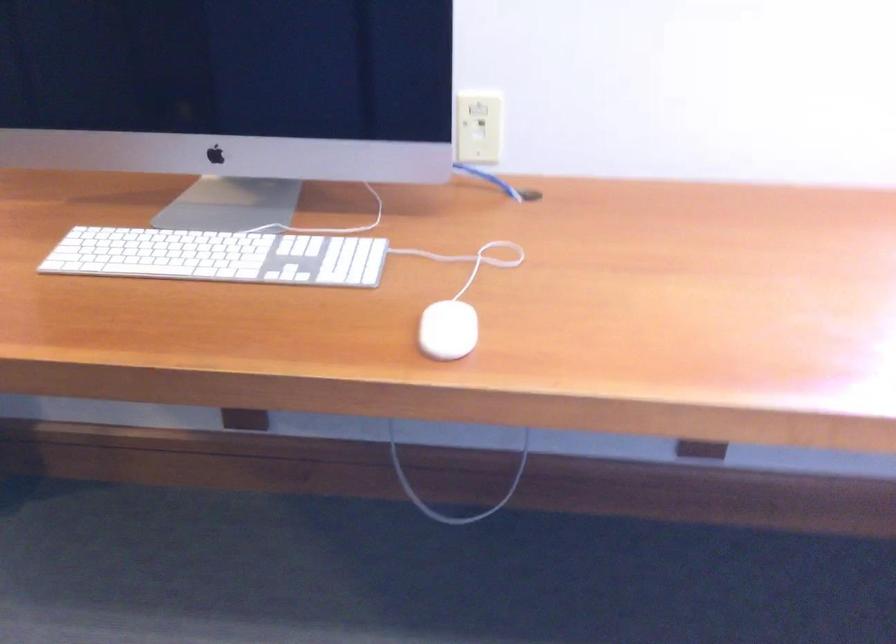
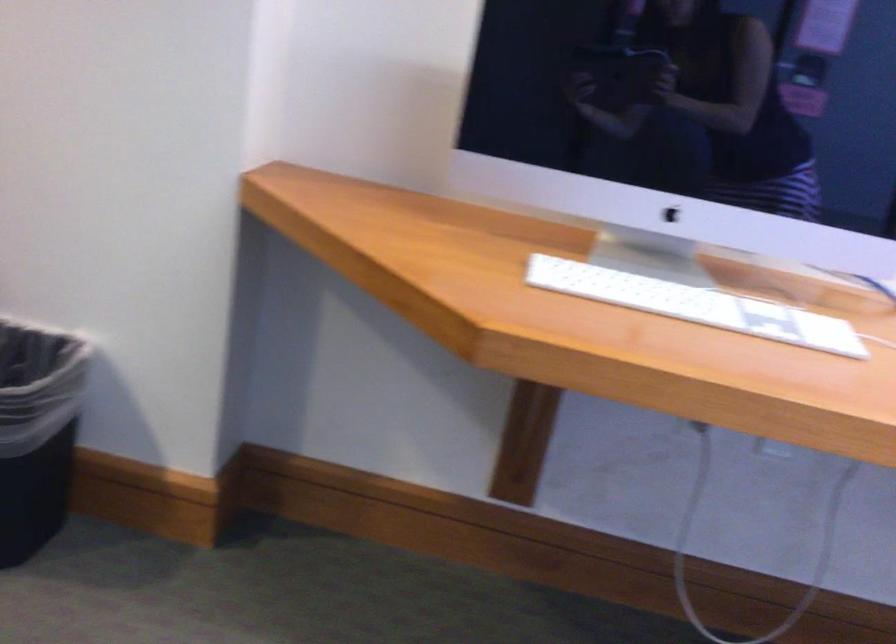
Question: The first image is from the beginning of the video and the second image is from the end. How did the camera likely rotate when shooting the video?

Choices:
 (A) Left
 (B) Right
 (C) Up
 (D) Down

Answer: (C)